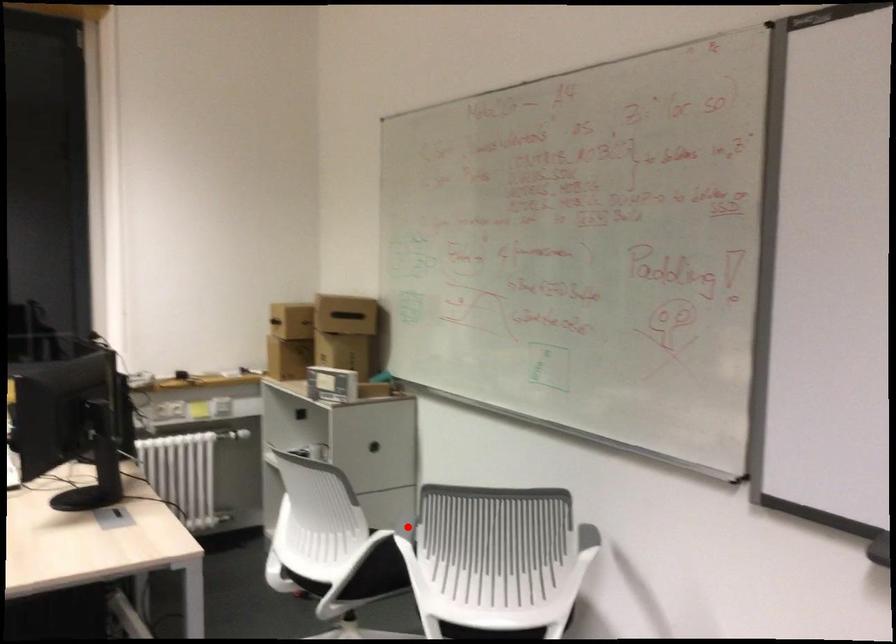
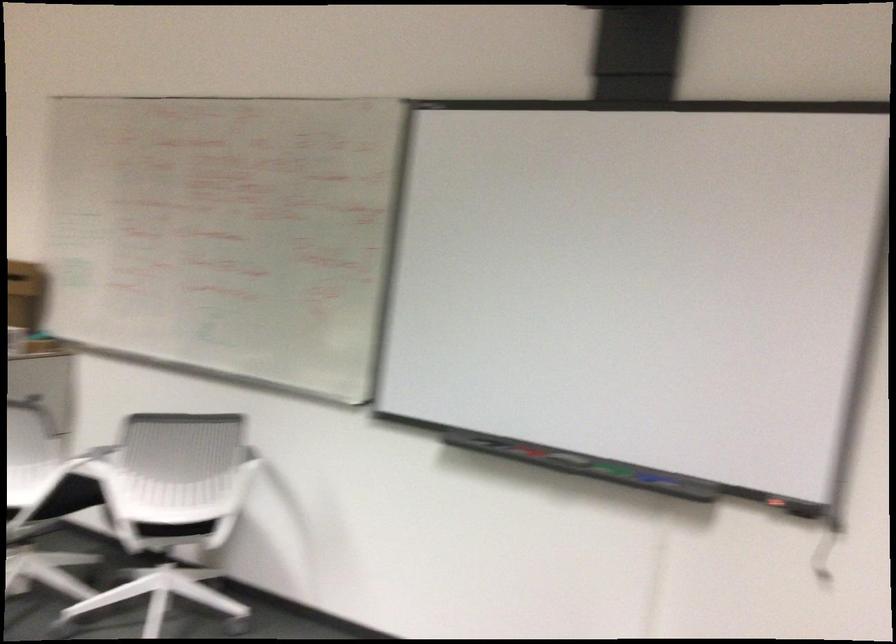
Locate, in the second image, the point that corresponds to the highlighted location in the first image.

(95, 460)